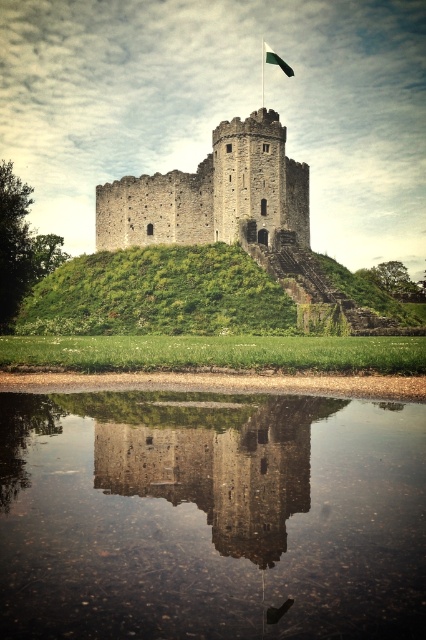
You are a drone operator tasked with capturing aerial footage of the smooth stone tower at center. The drone must hover exactly above the tower to get the best shot. Given the coordinates provided in the description, can you confirm the exact location where the drone should hover?

The smooth stone tower at center is located at point (215, 461), so the drone should hover directly above these coordinates to capture the best shot.

You are standing in front of the historic stone castle and want to determine the position of two specific points marked in the image. Which of the two points, point 1 at coordinates point (271, 467) or point 2 at coordinates point (284, 67), is closer to you?

Point 1 at coordinates point (271, 467) is closer to you than point 2 at coordinates point (284, 67).

You are standing in front of the castle and want to touch both the smooth stone tower at center and the stone medieval tower at center. Which one can you reach first as you walk towards the castle?

The smooth stone tower at center is closer to the viewer than the stone medieval tower at center, so you will reach the smooth stone tower at center first.